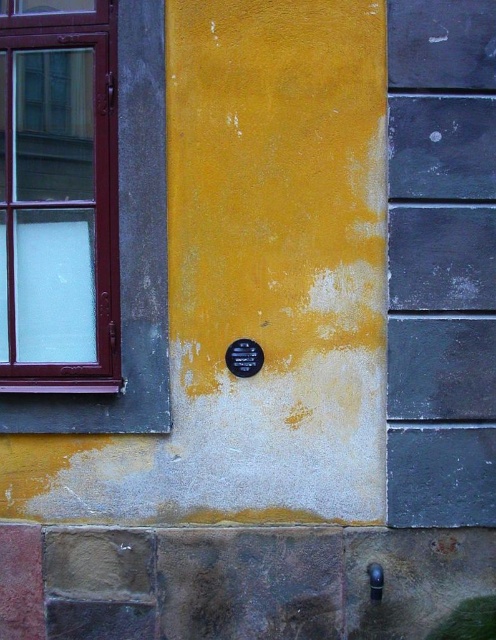
Can you confirm if matte glass window at left is positioned to the right of black metal plaque at center?

In fact, matte glass window at left is to the left of black metal plaque at center.

Where is `matte glass window at left`? The width and height of the screenshot is (496, 640). matte glass window at left is located at coordinates (58, 198).

This screenshot has width=496, height=640. I want to click on matte glass window at left, so click(58, 198).